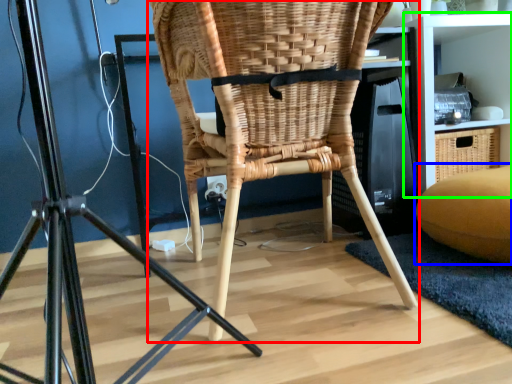
Question: Which object is the farthest from chair (highlighted by a red box)? Choose among these: bean bag chair (highlighted by a blue box) or shelf (highlighted by a green box).

Choices:
 (A) bean bag chair
 (B) shelf

Answer: (B)